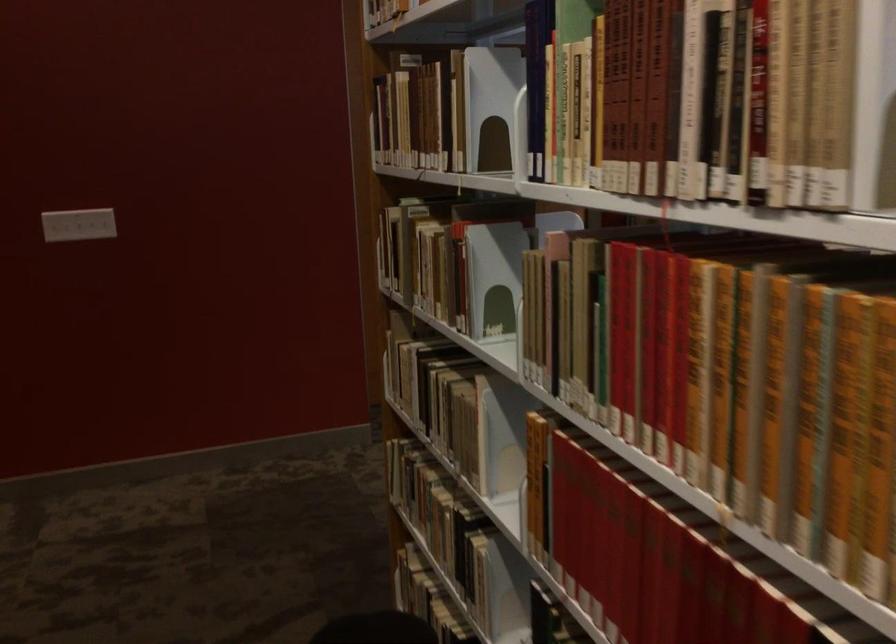
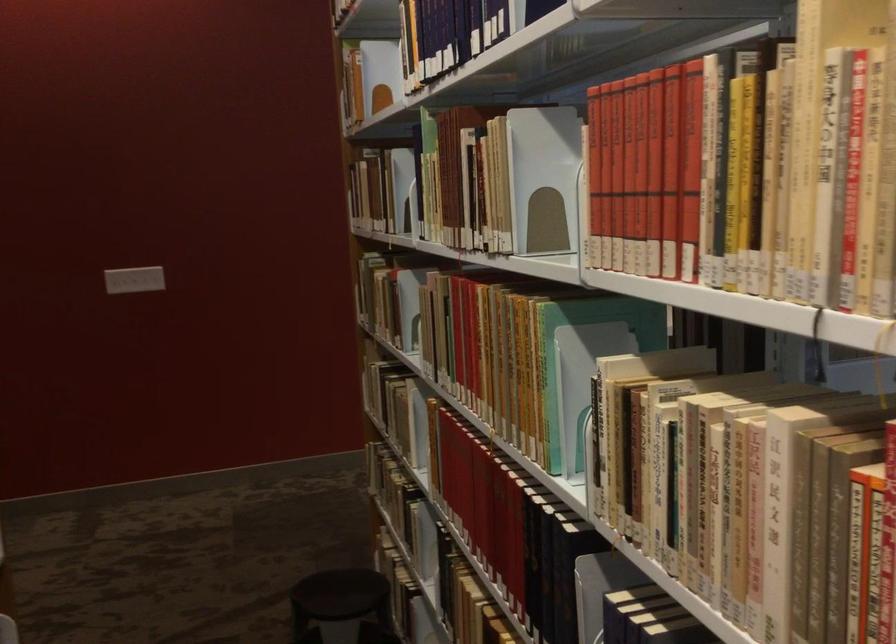
The point at [765,89] is marked in the first image. Where is the corresponding point in the second image?

(487, 187)